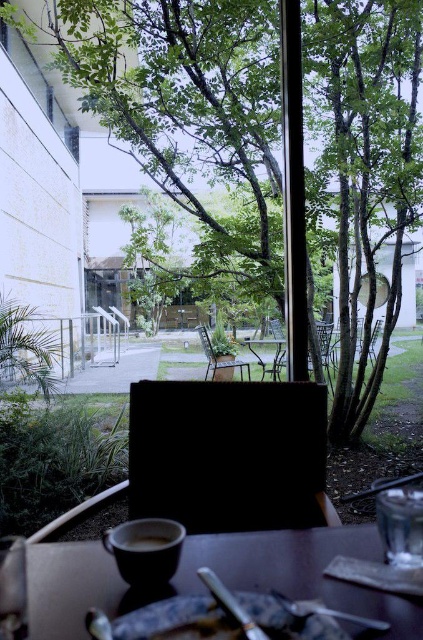
Can you confirm if matte ceramic cup at lower left is shorter than metallic silver fork at lower center?

In fact, matte ceramic cup at lower left may be taller than metallic silver fork at lower center.

Who is more forward, (x=136, y=584) or (x=337, y=616)?

Positioned in front is point (x=337, y=616).

Who is more forward, (173, 529) or (365, 627)?

Positioned in front is point (365, 627).

You are a GUI agent. You are given a task and a screenshot of the screen. Output one action in this format:
    pyautogui.click(x=<x>, y=<y>)
    Task: Click on the matte ceramic cup at lower left
    This screenshot has height=640, width=423.
    Given the screenshot: What is the action you would take?
    click(x=145, y=550)

Who is more distant from viewer, (279, 595) or (131, 548)?

The point (131, 548) is more distant.

Between point (370, 624) and point (142, 545), which one is positioned in front?

Positioned in front is point (370, 624).

Find the location of a particular element. Image resolution: width=423 pixels, height=640 pixels. metallic silver fork at lower center is located at coordinates [x=338, y=614].

Between matte brown table at lower center and matte ceramic cup at lower left, which one appears on the right side from the viewer's perspective?

Positioned to the right is matte brown table at lower center.

Between matte brown table at lower center and matte ceramic cup at lower left, which one has less height?

matte ceramic cup at lower left

Which is in front, point (386, 636) or point (120, 564)?

Positioned in front is point (386, 636).

You are a GUI agent. You are given a task and a screenshot of the screen. Output one action in this format:
    pyautogui.click(x=<x>, y=<y>)
    Task: Click on the matte brown table at lower center
    The height and width of the screenshot is (640, 423).
    Given the screenshot: What is the action you would take?
    pyautogui.click(x=299, y=570)